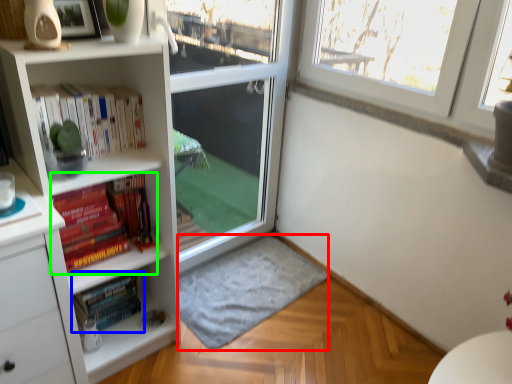
Question: Which object is the closest to the wide (highlighted by a red box)? Choose among these: book (highlighted by a blue box) or book (highlighted by a green box).

Choices:
 (A) book
 (B) book

Answer: (A)